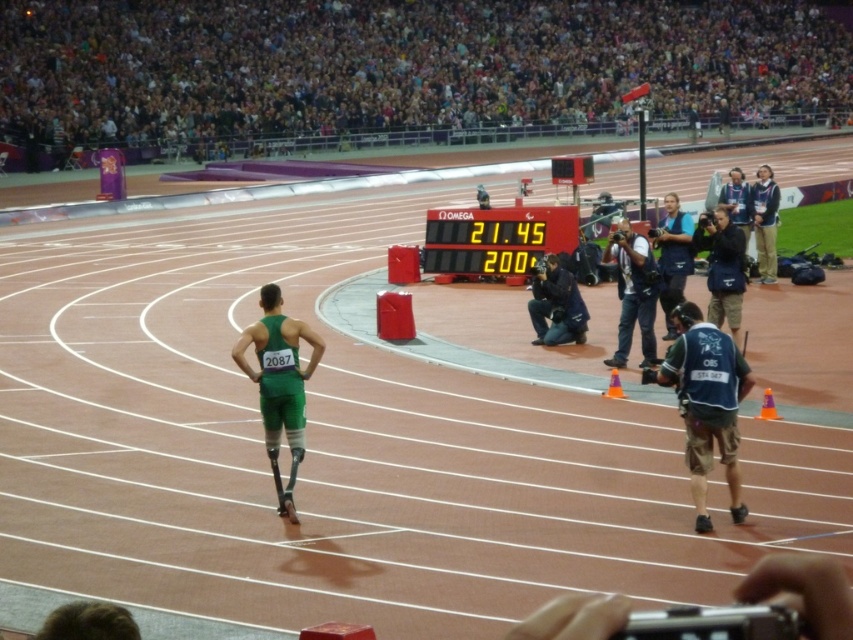
You are a photographer positioned at the edge of the track, aiming to capture a closeup shot of the dark blue fabric vest at center right. Given that your camera has a minimum focusing distance of 8 meters, will you be able to take the photo without moving closer?

The dark blue fabric vest at center right is 9.00 meters away from the viewer. Since the camera requires a minimum focusing distance of 8 meters, the photographer can take the closeup shot without moving closer because the distance is sufficient.

You are a photographer positioned at the edge of the track. You need to capture a photo of both the green matte prosthetic leg at center and the dark blue jacket at upper right. Which object will appear larger in your photo?

The green matte prosthetic leg at center will appear larger in the photo because it is closer to the viewer than the dark blue jacket at upper right.